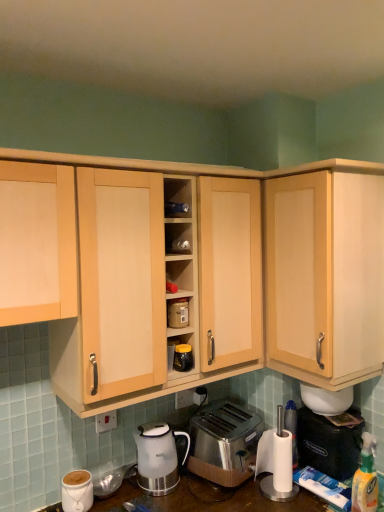
Question: Is satin white kettle at lower center taller or shorter than matte plastic container at center?

Choices:
 (A) tall
 (B) short

Answer: (A)

Question: Considering the positions of satin white kettle at lower center and matte plastic container at center in the image, is satin white kettle at lower center bigger or smaller than matte plastic container at center?

Choices:
 (A) big
 (B) small

Answer: (A)

Question: Estimate the real-world distances between objects in this image. Which object is farther from the light wood cabinet at upper left, which appears as the 3th cabinetry when viewed from the right?

Choices:
 (A) matte plastic container at center
 (B) satin white kettle at lower center
 (C) white plastic electric outlet at lower center, marked as the second electric outlet in a back-to-front arrangement
 (D) black plastic coffee machine at lower right
 (E) light wood cabinet at center, the second cabinetry positioned from the left

Answer: (D)

Question: Estimate the real-world distances between objects in this image. Which object is farther from the light wood cabinet at upper right, acting as the 1th cabinetry starting from the right?

Choices:
 (A) stainless steel toaster at lower center
 (B) matte plastic container at center
 (C) light wood cabinet at center, the 2th cabinetry in the right-to-left sequence
 (D) black glossy jar at center
 (E) satin white kettle at lower center

Answer: (E)